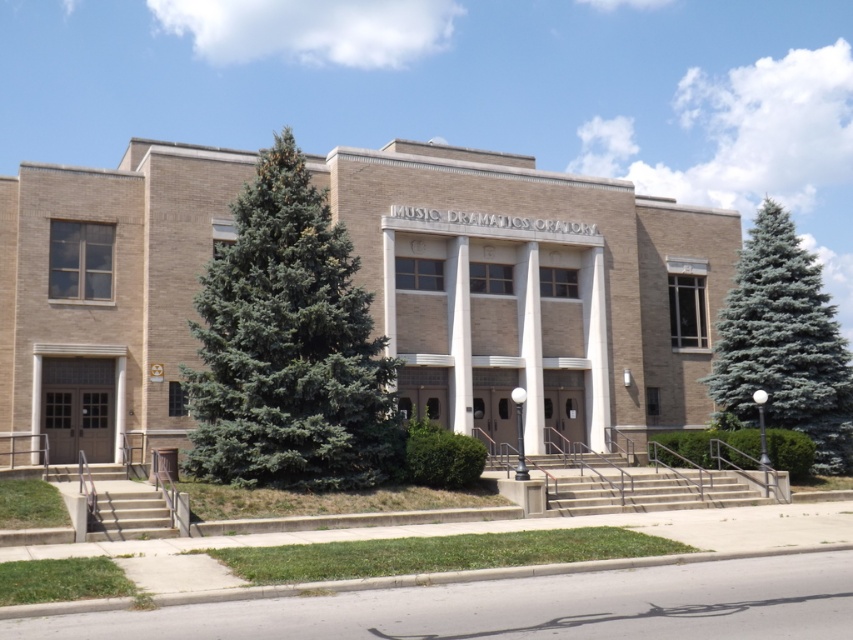
Question: Among these points, which one is nearest to the camera?

Choices:
 (A) (718, 384)
 (B) (339, 276)

Answer: (B)

Question: Is green needle-like at center thinner than blue-green coniferous tree at right?

Choices:
 (A) yes
 (B) no

Answer: (A)

Question: Which point is closer to the camera?

Choices:
 (A) blue-green coniferous tree at right
 (B) green needle-like at center

Answer: (B)

Question: Does green needle-like at center appear under blue-green coniferous tree at right?

Choices:
 (A) no
 (B) yes

Answer: (B)

Question: From the image, what is the correct spatial relationship of green needle-like at center in relation to blue-green coniferous tree at right?

Choices:
 (A) right
 (B) left

Answer: (B)